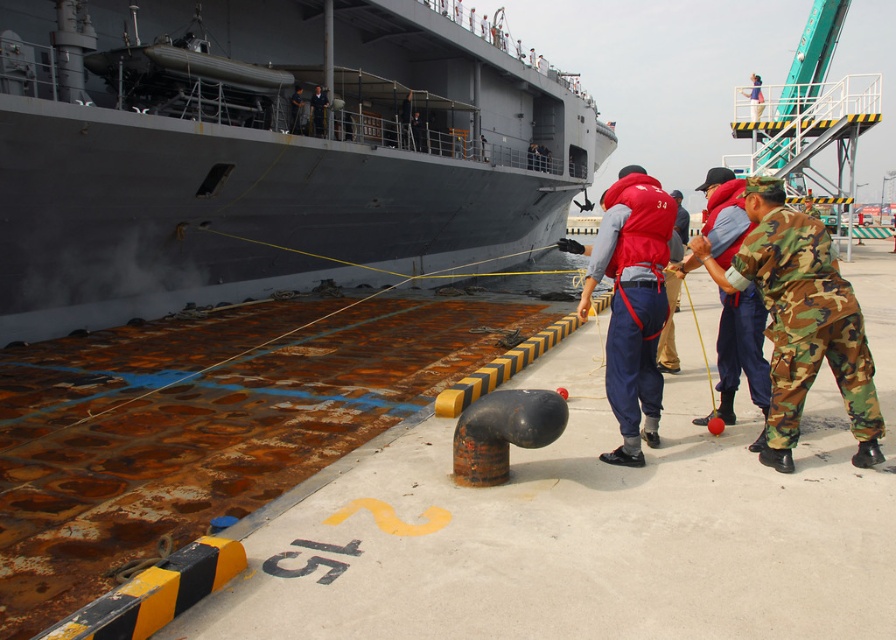
The image size is (896, 640). I want to click on camo fabric soldier at lower right, so click(800, 321).

Which of these two, camo fabric soldier at lower right or red fabric life vest at center, stands shorter?

Standing shorter between the two is camo fabric soldier at lower right.

You are a GUI agent. You are given a task and a screenshot of the screen. Output one action in this format:
    pyautogui.click(x=<x>, y=<y>)
    Task: Click on the camo fabric soldier at lower right
    The width and height of the screenshot is (896, 640).
    Given the screenshot: What is the action you would take?
    pyautogui.click(x=800, y=321)

Can you confirm if gray matte ship at upper left is taller than red fabric life vest at center?

Yes.

Is gray matte ship at upper left smaller than red fabric life vest at center?

No, gray matte ship at upper left is not smaller than red fabric life vest at center.

The width and height of the screenshot is (896, 640). What do you see at coordinates (266, 152) in the screenshot? I see `gray matte ship at upper left` at bounding box center [266, 152].

You are a GUI agent. You are given a task and a screenshot of the screen. Output one action in this format:
    pyautogui.click(x=<x>, y=<y>)
    Task: Click on the gray matte ship at upper left
    Image resolution: width=896 pixels, height=640 pixels.
    Given the screenshot: What is the action you would take?
    pyautogui.click(x=266, y=152)

Which is below, gray matte ship at upper left or camo fabric soldier at lower right?

camo fabric soldier at lower right is below.

Locate an element on the screen. gray matte ship at upper left is located at coordinates (266, 152).

Is point (225, 280) farther from viewer compared to point (845, 321)?

Yes, it is.

At what (x,y) coordinates should I click in order to perform the action: click on gray matte ship at upper left. Please return your answer as a coordinate pair (x, y). Image resolution: width=896 pixels, height=640 pixels. Looking at the image, I should click on (266, 152).